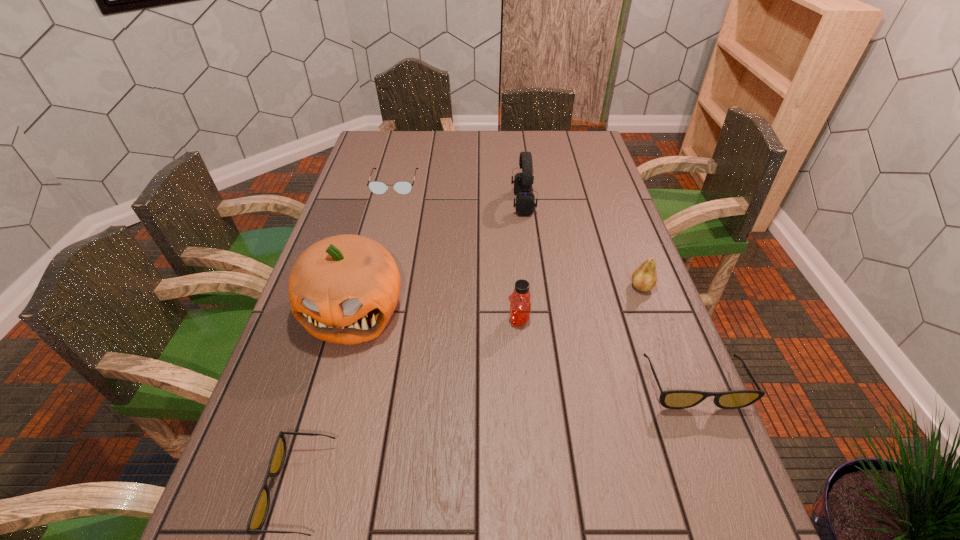
To achieve even spacing by inserting another sunglasses among them, please point to a vacant spot for this new sunglasses. Please provide its 2D coordinates. Your answer should be formatted as a tuple, i.e. [(x, y)], where the tuple contains the x and y coordinates of a point satisfying the conditions above.

[(515, 433)]